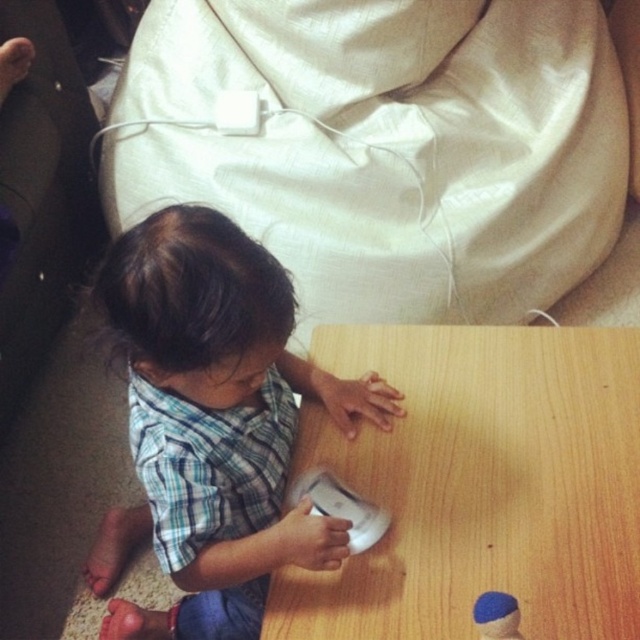
Who is taller, wooden table at center or blue felt hat at lower right?

With more height is wooden table at center.

Is wooden table at center smaller than blue felt hat at lower right?

No.

Who is more distant from viewer, (538, 468) or (509, 605)?

Point (538, 468)

This screenshot has height=640, width=640. I want to click on wooden table at center, so click(x=481, y=484).

Does wooden table at center appear under white matte wii remote at center?

No.

Who is more distant from viewer, (371,586) or (348,545)?

The point (371,586) is more distant.

This screenshot has height=640, width=640. I want to click on wooden table at center, so click(x=481, y=484).

Can you confirm if white matte wii remote at center is taller than blue felt hat at lower right?

Indeed, white matte wii remote at center has a greater height compared to blue felt hat at lower right.

Between white matte wii remote at center and blue felt hat at lower right, which one appears on the right side from the viewer's perspective?

Positioned to the right is blue felt hat at lower right.

Is point (292, 500) behind point (515, 611)?

Yes, point (292, 500) is farther from viewer.

Locate an element on the screen. white matte wii remote at center is located at coordinates (340, 506).